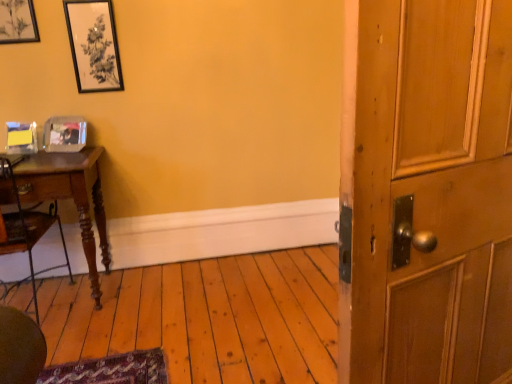
The height and width of the screenshot is (384, 512). I want to click on free location in front of clear plastic picture frame at left, which is the third picture frame in top-to-bottom order, so 53,153.